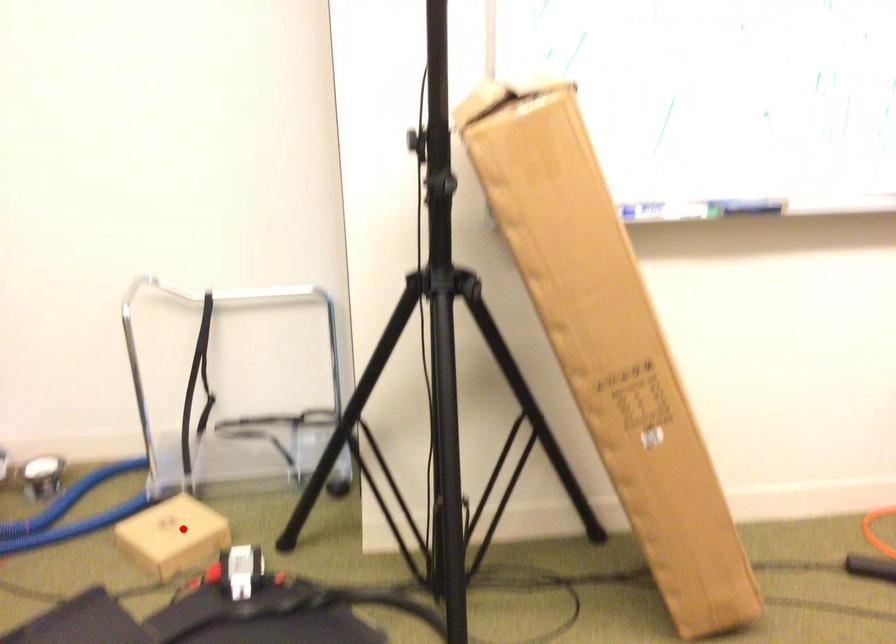
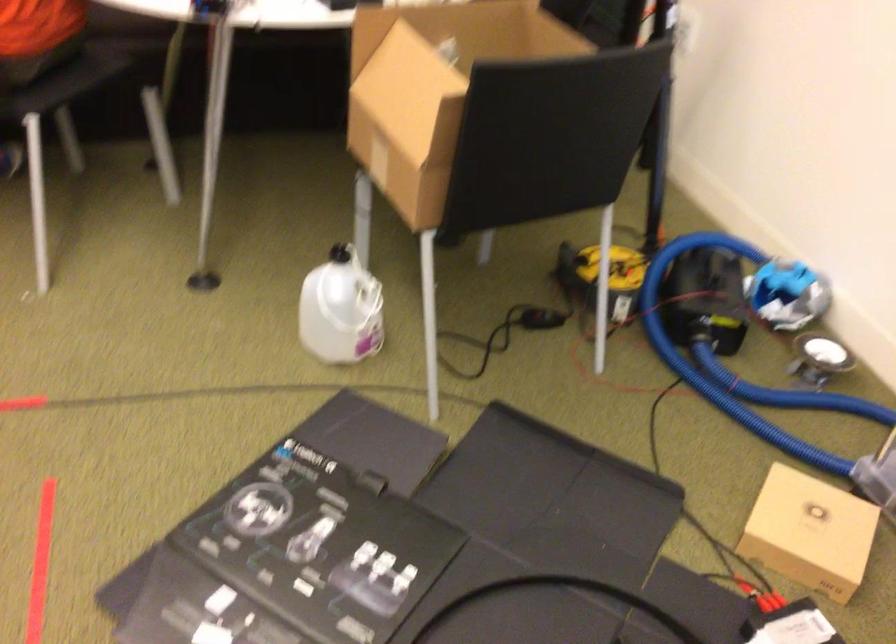
Question: A red point is marked in image1. In image2, is the corresponding 3D point closer to the camera or farther? Reply with the corresponding letter.

Choices:
 (A) The corresponding 3D point is closer.
 (B) The corresponding 3D point is farther.

Answer: (A)